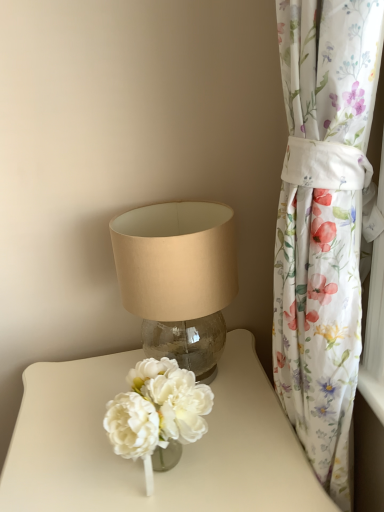
Identify the location of free space that is to the left of beige fabric lampshade at center. (81, 394).